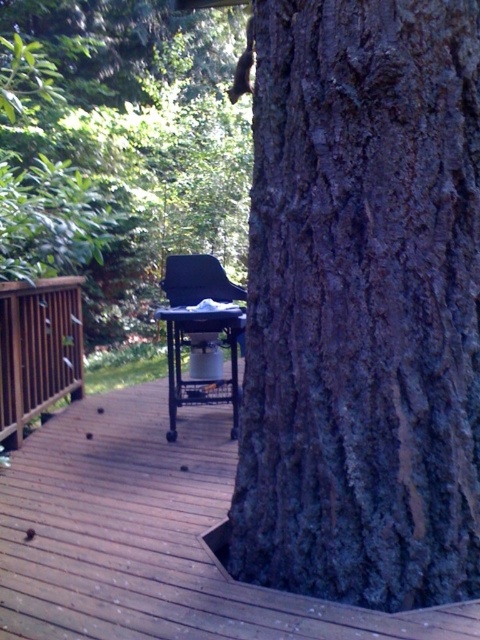
Question: Which of the following is the farthest from the observer?

Choices:
 (A) matte black barbecue grill at center
 (B) dark gray bark at center
 (C) brown wooden deck at center
 (D) brown wooden rail at left

Answer: (D)

Question: Is dark gray bark at center positioned in front of brown wooden rail at left?

Choices:
 (A) no
 (B) yes

Answer: (B)

Question: Which point appears closest to the camera in this image?

Choices:
 (A) (131, 627)
 (B) (428, 557)

Answer: (A)

Question: Is brown wooden deck at center to the left of brown wooden rail at left from the viewer's perspective?

Choices:
 (A) no
 (B) yes

Answer: (A)

Question: Which point is closer to the camera?

Choices:
 (A) (351, 506)
 (B) (58, 292)
 (C) (170, 522)

Answer: (A)

Question: Can you confirm if brown wooden deck at center is positioned above brown wooden rail at left?

Choices:
 (A) no
 (B) yes

Answer: (A)